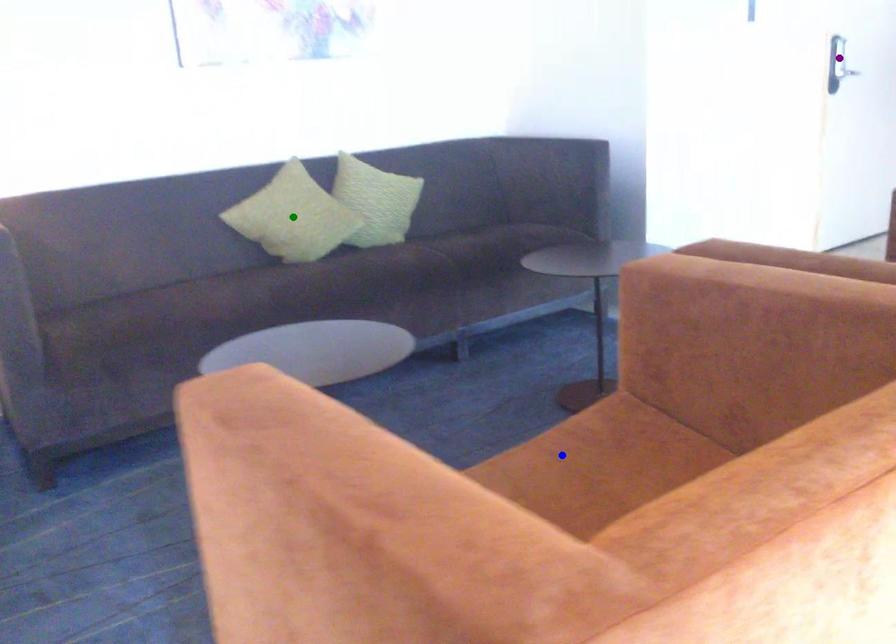
Order these from farthest to nearest:
purple point, blue point, green point

purple point < green point < blue point